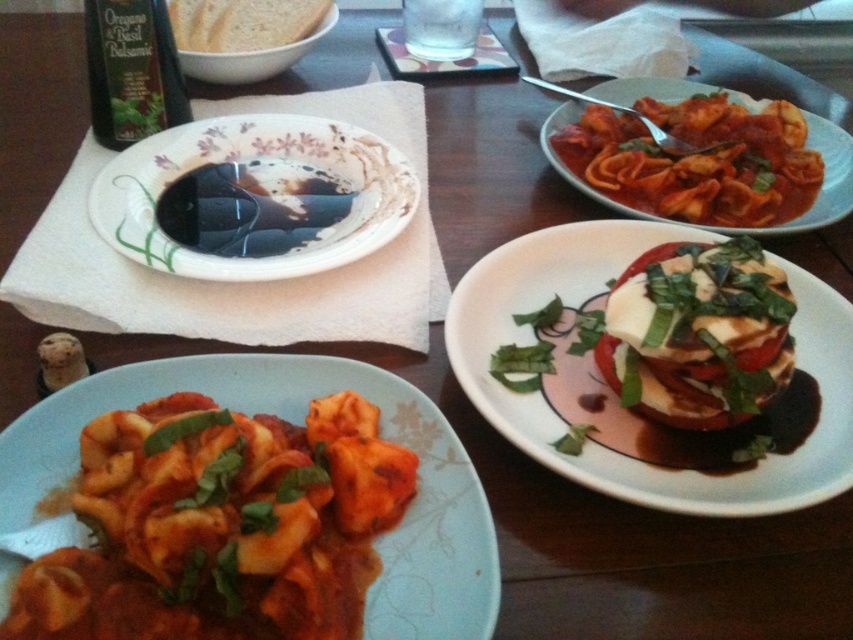
Question: Which object is farther from the camera taking this photo?

Choices:
 (A) white glossy plate at center
 (B) matte tomato sauce tortellini at upper right
 (C) white creamy cheese at center

Answer: (B)

Question: Does white glossy plate at upper left appear on the right side of white matte bread at upper left?

Choices:
 (A) yes
 (B) no

Answer: (A)

Question: Is matte tortellini at lower left positioned behind black glossy bowl at upper center?

Choices:
 (A) no
 (B) yes

Answer: (A)

Question: Which point is closer to the camera?

Choices:
 (A) (273, 636)
 (B) (732, 304)
 (C) (194, 256)

Answer: (A)

Question: Can you confirm if white glossy plate at upper left is bigger than black glossy bowl at upper center?

Choices:
 (A) yes
 (B) no

Answer: (A)

Question: Which object is positioned farthest from the matte tomato sauce tortellini at upper right?

Choices:
 (A) white glossy plate at upper left
 (B) matte tortellini at lower left

Answer: (B)